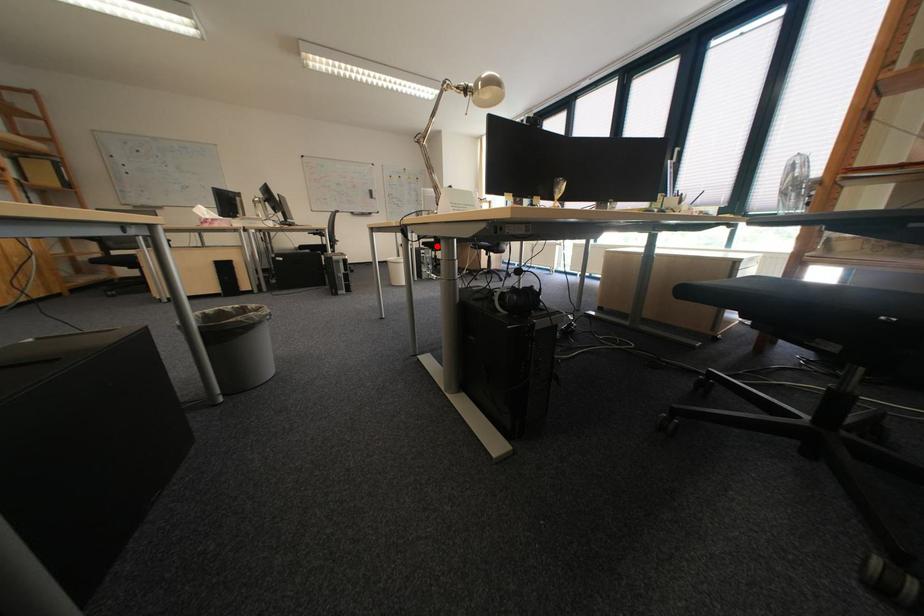
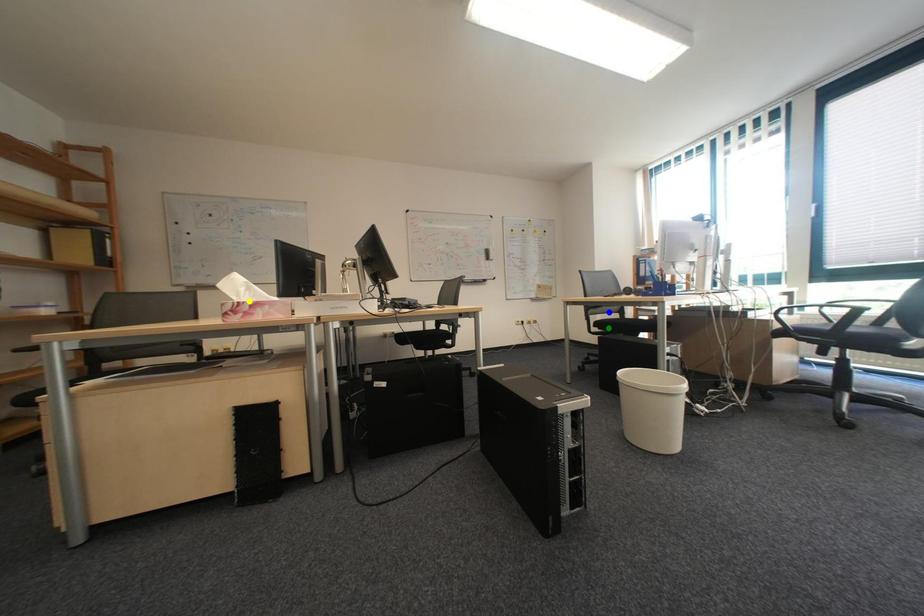
Question: I am providing you with two images of the same scene from different viewpoints. A red point is marked on the first image. You are given multiple points on the second image. Which mark in image 2 goes with the point in image 1?

Choices:
 (A) green point
 (B) yellow point
 (C) blue point

Answer: (A)